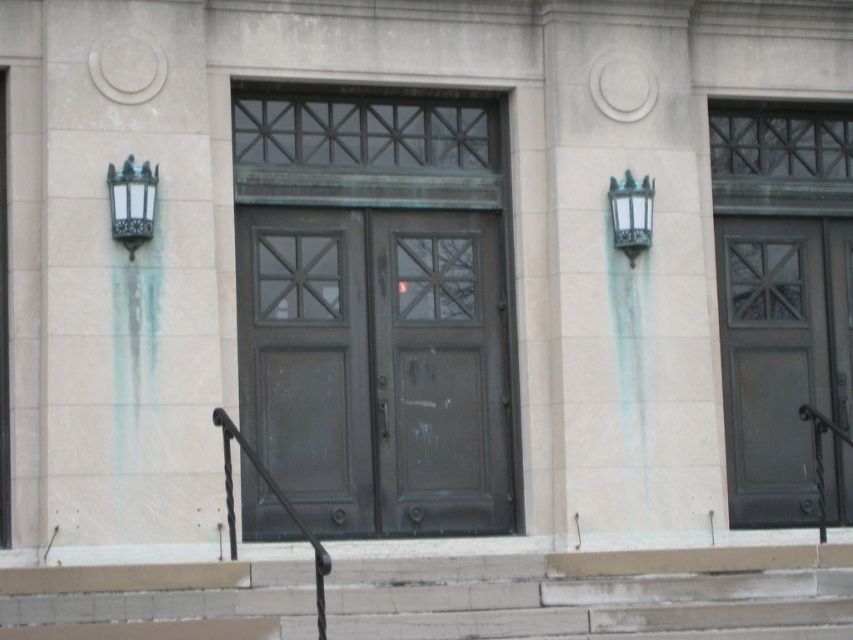
Question: Is black wrought iron handrail at center further to camera compared to green patina lamp at upper right?

Choices:
 (A) no
 (B) yes

Answer: (A)

Question: Is the position of black wrought iron handrail at center less distant than that of green patina lamp at upper right?

Choices:
 (A) no
 (B) yes

Answer: (B)

Question: Which of the following is the farthest from the observer?

Choices:
 (A) (648, 208)
 (B) (782, 301)
 (C) (405, 493)
 (D) (318, 616)

Answer: (B)

Question: Can you confirm if matte dark brown door at right is smaller than green patina lamp at upper right?

Choices:
 (A) no
 (B) yes

Answer: (A)

Question: Among these points, which one is farthest from the camera?

Choices:
 (A) (648, 179)
 (B) (134, 252)
 (C) (354, 516)

Answer: (A)

Question: Estimate the real-world distances between objects in this image. Which object is closer to the green patina doors at center?

Choices:
 (A) green patina lamp at upper right
 (B) bronze textured lamp at upper left
 (C) matte dark brown door at right

Answer: (A)